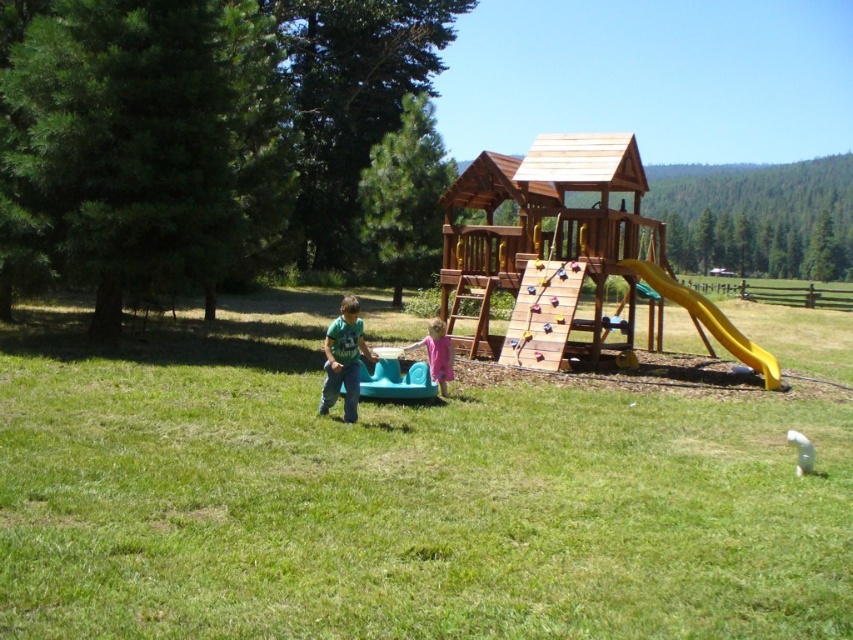
Based on the photo, you are a parent trying to locate your child who is playing near the green plastic wagon at center. Based on the coordinates provided, can you determine if the wagon is positioned closer to the front or the back of the play area?

The green plastic wagon at center is located at coordinates point (399, 497). Since the coordinates are measured from the bottom left corner, a higher x value indicates a position further to the right, and a higher y value indicates a position further up. However, without knowing the exact dimensions of the play area, it is impossible to definitively determine if the wagon is closer to the front or back. Please provide more information about the play area layout.

You are standing in the middle of the grassy lawn looking at the wooden play structure. There are two points marked in the image. Which point is closer to you, point (x=361, y=348) or point (x=798, y=464)?

Point (x=361, y=348) is further to the camera than point (x=798, y=464), so point (x=798, y=464) is closer to you.